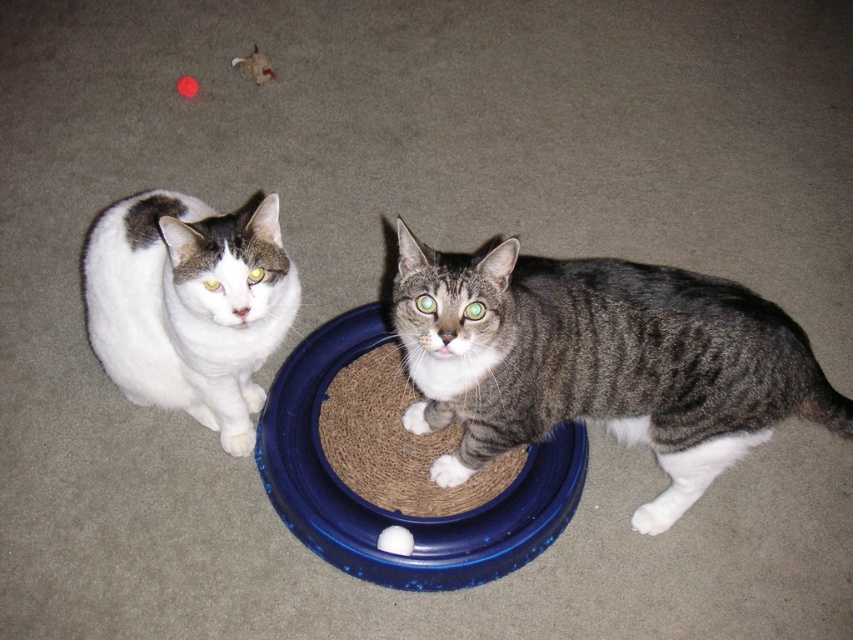
You are a cat owner who wants to place a new cat tree in the room. The cat tree will be placed at the point marked by the coordinates point (x=601, y=362). Which cat will the cat tree be placed near?

The cat tree will be placed near the gray tabby cat at center because the point (x=601, y=362) marks its location.

You are a cat owner who wants to place a new rectangular cat bed in the space between the gray tabby cat at center and the white fur cat at left. The bed is 1.2 meters wide. Can both cats fit on the bed comfortably without overlapping?

The gray tabby cat at center might be wider than white fur cat at left, so the combined width of both cats could exceed the 1.2 meter bed. It is uncertain if they can fit comfortably without overlapping.